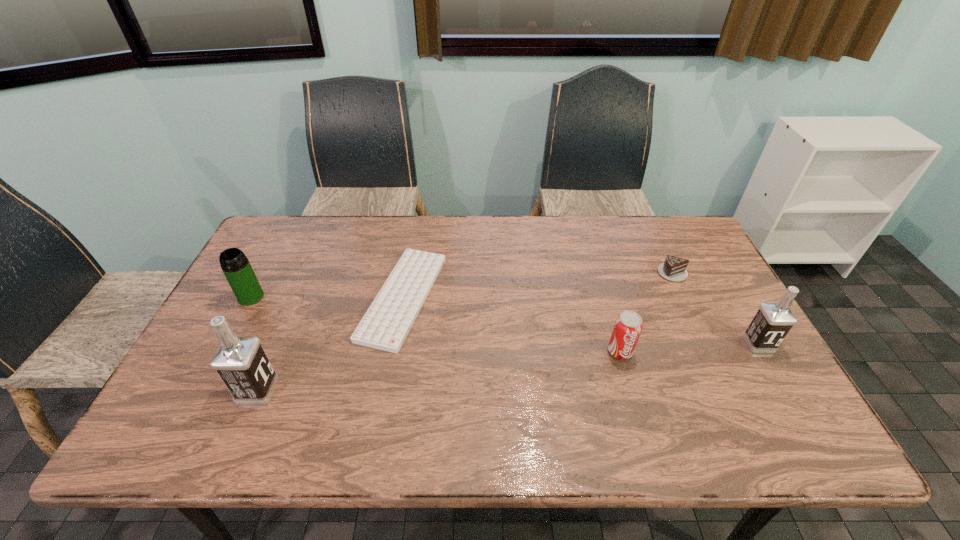
In order to click on the fifth object from left to right in this screenshot , I will do `click(674, 269)`.

This screenshot has height=540, width=960. Identify the location of vacant space located 0.330m on the front label of the nearest object. (413, 390).

Where is `free region located 0.120m on the front label of the shorter vodka`? This screenshot has height=540, width=960. free region located 0.120m on the front label of the shorter vodka is located at coordinates (788, 394).

You are a GUI agent. You are given a task and a screenshot of the screen. Output one action in this format:
    pyautogui.click(x=<x>, y=<y>)
    Task: Click on the vacant space situated 0.060m on the left of the third object from left to right
    The image size is (960, 540).
    Given the screenshot: What is the action you would take?
    click(x=343, y=297)

Image resolution: width=960 pixels, height=540 pixels. What are the coordinates of `free point located 0.140m from the spout of the thermos bottle` in the screenshot? It's located at (226, 345).

Where is `vacant space located on the back of the second shortest object`? vacant space located on the back of the second shortest object is located at coordinates (659, 244).

Locate an element on the screen. The width and height of the screenshot is (960, 540). object that is at the far edge is located at coordinates (385, 325).

You are a GUI agent. You are given a task and a screenshot of the screen. Output one action in this format:
    pyautogui.click(x=<x>, y=<y>)
    Task: Click on the object that is at the near edge
    
    Given the screenshot: What is the action you would take?
    pyautogui.click(x=240, y=361)

Where is `vodka present at the left edge`? This screenshot has width=960, height=540. vodka present at the left edge is located at coordinates pos(240,361).

Find the location of a particular element. The image size is (960, 540). thermos bottle located at the left edge is located at coordinates pyautogui.click(x=236, y=267).